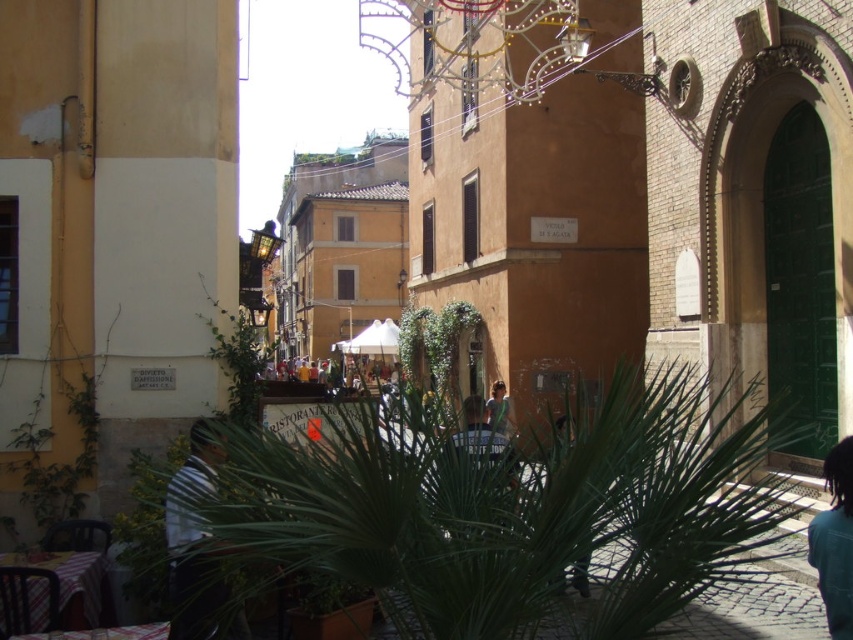
Which of these two, green leafy palm tree at center or black hair at lower right, stands shorter?

Standing shorter between the two is green leafy palm tree at center.

Does green leafy palm tree at center have a larger size compared to black hair at lower right?

Indeed, green leafy palm tree at center has a larger size compared to black hair at lower right.

Identify the location of green leafy palm tree at center. This screenshot has width=853, height=640. (506, 513).

At what (x,y) coordinates should I click in order to perform the action: click on green leafy palm tree at center. Please return your answer as a coordinate pair (x, y). Image resolution: width=853 pixels, height=640 pixels. Looking at the image, I should click on coord(506,513).

Which is more to the left, green leafy palm tree at center or light brown leather jacket at center?

light brown leather jacket at center

Who is more distant from viewer, [419,467] or [492,396]?

The point [492,396] is behind.

I want to click on green leafy palm tree at center, so click(506, 513).

Which is more to the right, black hair at lower right or light brown leather jacket at center?

From the viewer's perspective, black hair at lower right appears more on the right side.

Which of these two, black hair at lower right or light brown leather jacket at center, stands shorter?

With less height is black hair at lower right.

In order to click on black hair at lower right in this screenshot , I will do `click(834, 541)`.